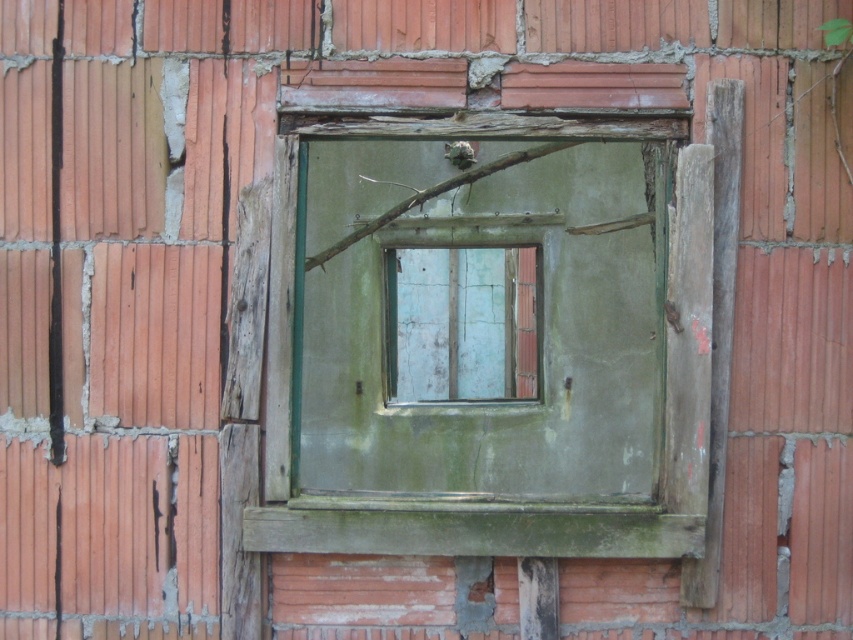
Question: Is green weathered wood at center below peeling paint window at center?

Choices:
 (A) yes
 (B) no

Answer: (B)

Question: Which object is closer to the camera taking this photo?

Choices:
 (A) peeling paint window at center
 (B) green weathered wood at center

Answer: (B)

Question: Does green weathered wood at center appear on the left side of peeling paint window at center?

Choices:
 (A) yes
 (B) no

Answer: (B)

Question: Is green weathered wood at center below peeling paint window at center?

Choices:
 (A) yes
 (B) no

Answer: (B)

Question: Which object appears farthest from the camera in this image?

Choices:
 (A) green weathered wood at center
 (B) peeling paint window at center

Answer: (B)